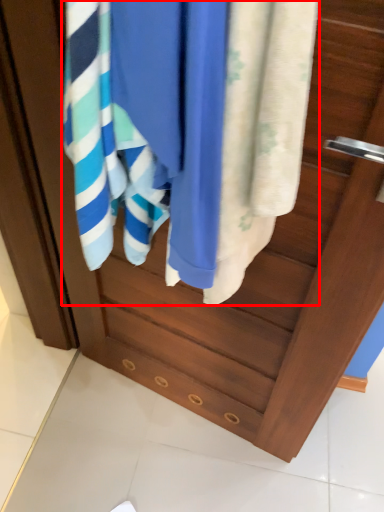
Question: From the image, what is the correct spatial relationship of bath towel (annotated by the red box) in relation to towel?

Choices:
 (A) left
 (B) right

Answer: (A)